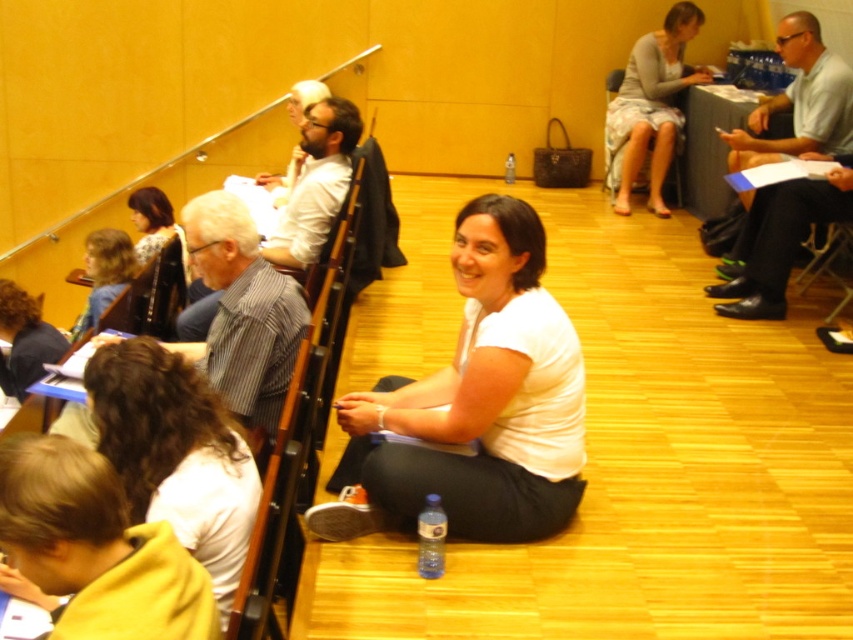
Question: Can you confirm if blonde hair at lower left is thinner than wooden chair at upper right?

Choices:
 (A) no
 (B) yes

Answer: (A)

Question: Is white cotton shirt at center positioned before light gray textured sweater at upper right?

Choices:
 (A) yes
 (B) no

Answer: (A)

Question: Which point is farther to the camera?

Choices:
 (A) (660, 40)
 (B) (541, 316)
 (C) (643, 182)

Answer: (C)

Question: Is light gray textured sweater at upper right wider than matte black jacket at upper left?

Choices:
 (A) no
 (B) yes

Answer: (B)

Question: Which object is closer to the camera taking this photo?

Choices:
 (A) white cotton shirt at center
 (B) light gray textured sweater at upper right
 (C) matte black jacket at upper left

Answer: (A)

Question: Which point is closer to the camera?

Choices:
 (A) (100, 252)
 (B) (618, 211)

Answer: (A)